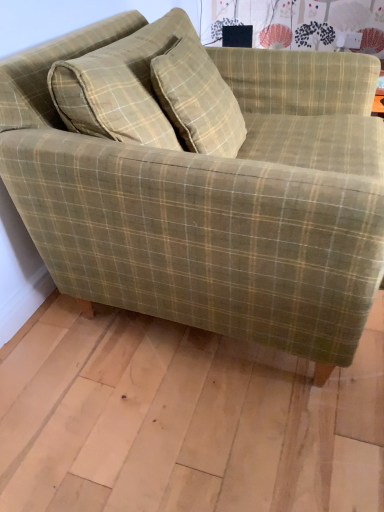
You are a GUI agent. You are given a task and a screenshot of the screen. Output one action in this format:
    pyautogui.click(x=<x>, y=<y>)
    Task: Click on the green plaid fabric couch at center
    
    Given the screenshot: What is the action you would take?
    pyautogui.click(x=200, y=185)

What do you see at coordinates (200, 185) in the screenshot? I see `green plaid fabric couch at center` at bounding box center [200, 185].

Identify the location of green plaid fabric couch at center. Image resolution: width=384 pixels, height=512 pixels. (200, 185).